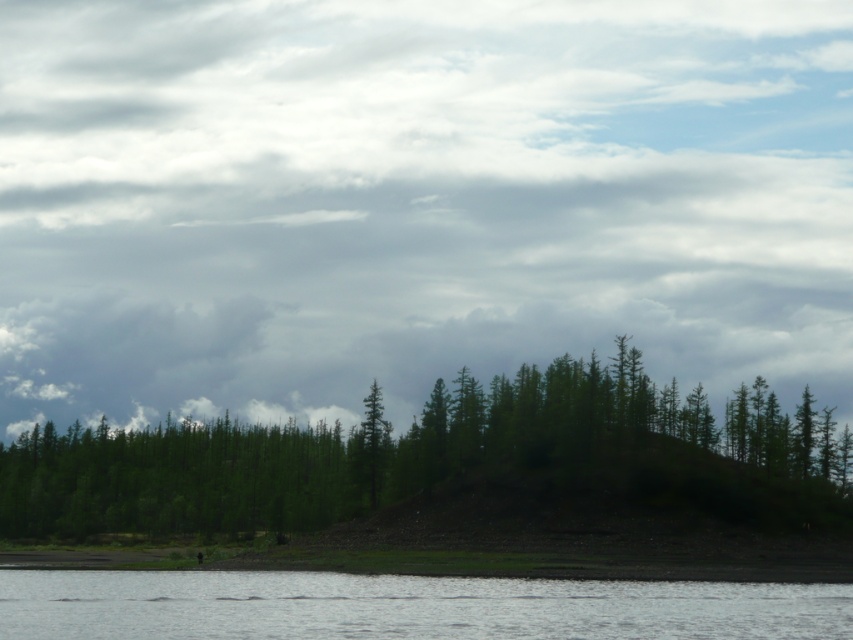
This screenshot has height=640, width=853. Describe the element at coordinates (415, 200) in the screenshot. I see `cloudy sky at upper center` at that location.

Is point (759, 38) more distant than point (612, 477)?

Yes, point (759, 38) is farther from viewer.

The height and width of the screenshot is (640, 853). What do you see at coordinates (415, 200) in the screenshot?
I see `cloudy sky at upper center` at bounding box center [415, 200].

Where is `cloudy sky at upper center`? The image size is (853, 640). cloudy sky at upper center is located at coordinates (415, 200).

Can you confirm if clear water at lower center is positioned to the right of green matte tree at center?

Yes, clear water at lower center is to the right of green matte tree at center.

How far apart are clear water at lower center and green matte tree at center?

A distance of 202.31 feet exists between clear water at lower center and green matte tree at center.

Which is behind, point (761, 582) or point (376, 433)?

Point (376, 433)

Locate an element on the screen. The width and height of the screenshot is (853, 640). clear water at lower center is located at coordinates (405, 605).

Does green matte forest at center appear on the left side of clear water at lower center?

Yes, green matte forest at center is to the left of clear water at lower center.

Is green matte forest at center bigger than clear water at lower center?

Yes.

Between point (138, 518) and point (537, 582), which one is positioned behind?

The point (138, 518) is behind.

This screenshot has height=640, width=853. In order to click on green matte forest at center in this screenshot , I will do `click(630, 444)`.